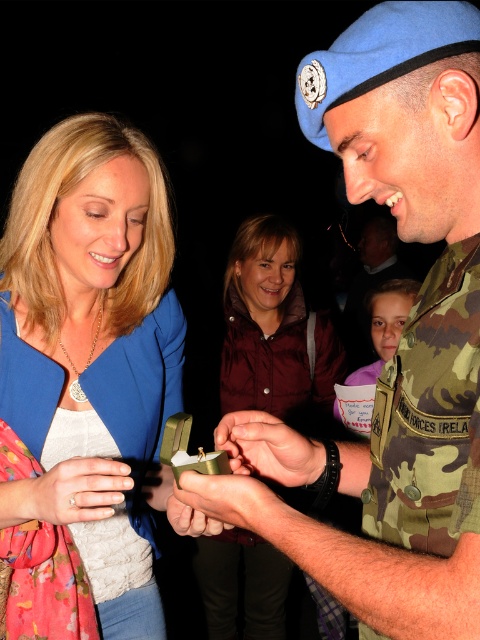
Is camouflage uniform at center further to the viewer compared to camouflage fabric hand at center?

No, camouflage uniform at center is closer to the viewer.

Which is below, camouflage uniform at center or camouflage fabric hand at center?

Positioned lower is camouflage fabric hand at center.

Is point (350, 189) farther from viewer compared to point (287, 429)?

No, (350, 189) is closer to viewer.

Locate an element on the screen. This screenshot has width=480, height=640. camouflage uniform at center is located at coordinates (407, 323).

Is point (435, 490) farther from camera compared to point (260, 385)?

No, (435, 490) is closer to viewer.

The width and height of the screenshot is (480, 640). What are the coordinates of `camouflage uniform at center` in the screenshot? It's located at (407, 323).

Is blue fabric jacket at upper left behind metallic gold ring at center?

Yes, blue fabric jacket at upper left is behind metallic gold ring at center.

What do you see at coordinates (86, 381) in the screenshot? I see `blue fabric jacket at upper left` at bounding box center [86, 381].

The width and height of the screenshot is (480, 640). Identify the location of blue fabric jacket at upper left. (86, 381).

Where is `blue fabric jacket at upper left`? blue fabric jacket at upper left is located at coordinates (86, 381).